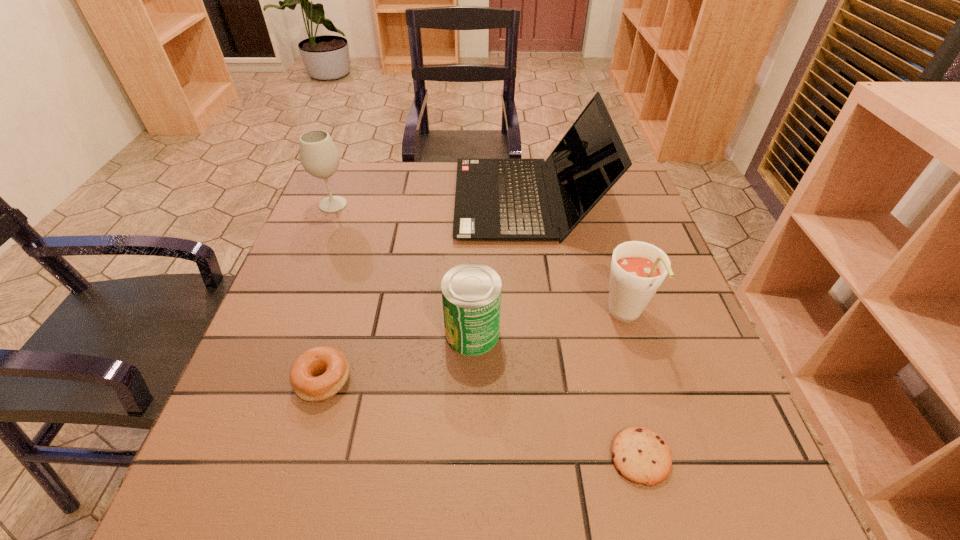
I want to click on free space located 0.360m on the screen of the laptop computer, so click(326, 199).

Find the location of a particular element. The height and width of the screenshot is (540, 960). vacant space situated on the front of the leftmost object is located at coordinates (281, 335).

Identify the location of vacant space located 0.270m on the drink side of the root beer. (677, 486).

Where is `free region located 0.160m on the back of the third shortest object`? The height and width of the screenshot is (540, 960). free region located 0.160m on the back of the third shortest object is located at coordinates (473, 260).

I want to click on blank area located 0.120m on the back of the second shortest object, so click(344, 310).

Find the location of `vacant space positioned 0.110m on the back of the cookie`. vacant space positioned 0.110m on the back of the cookie is located at coordinates (619, 374).

Where is `laptop computer present at the far edge`? laptop computer present at the far edge is located at coordinates click(495, 199).

Locate an element on the screen. The height and width of the screenshot is (540, 960). wineglass present at the far edge is located at coordinates 319,156.

Locate an element on the screen. object situated at the near edge is located at coordinates (640, 455).

I want to click on wineglass that is at the left edge, so click(319, 156).